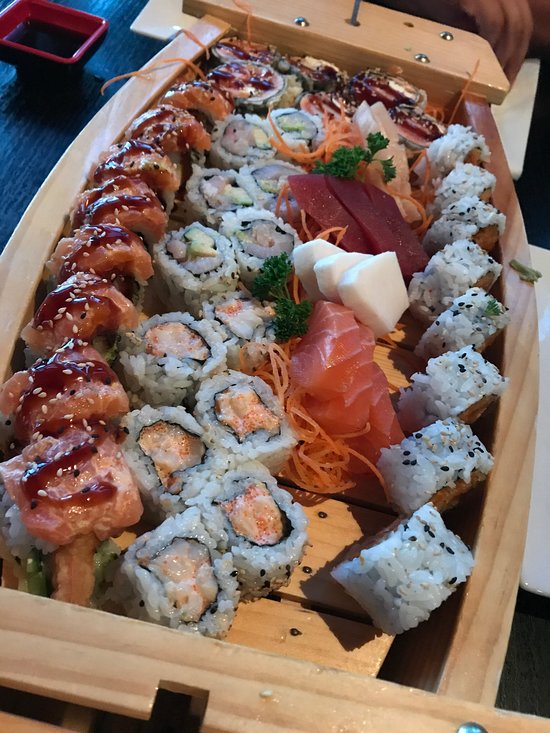
Where is `tray`? This screenshot has height=733, width=550. tray is located at coordinates (461, 668).